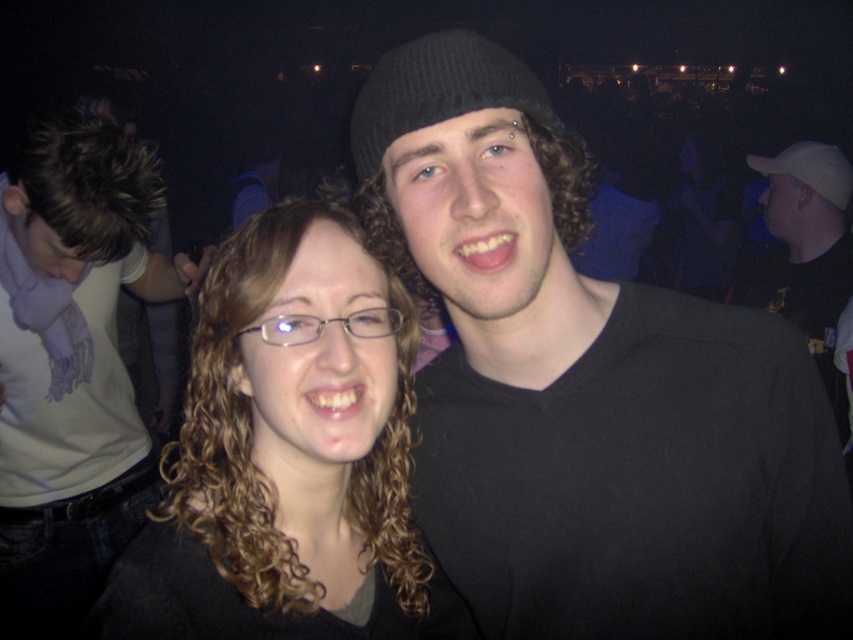
Question: Which object is the farthest from the curly hair at center?

Choices:
 (A) white t-shirt at left
 (B) black matte shirt at center
 (C) black knit beanie at center

Answer: (A)

Question: Where is black matte shirt at center located in relation to white t-shirt at left in the image?

Choices:
 (A) right
 (B) left

Answer: (A)

Question: Among these objects, which one is nearest to the camera?

Choices:
 (A) curly hair at center
 (B) white t-shirt at left
 (C) black knit beanie at center
 (D) black matte shirt at center

Answer: (D)

Question: Is white t-shirt at left to the right of black knit beanie at center from the viewer's perspective?

Choices:
 (A) no
 (B) yes

Answer: (A)

Question: Which object is the farthest from the black matte shirt at center?

Choices:
 (A) black knit beanie at center
 (B) curly hair at center
 (C) white t-shirt at left

Answer: (C)

Question: Is black matte shirt at center above curly hair at center?

Choices:
 (A) no
 (B) yes

Answer: (B)